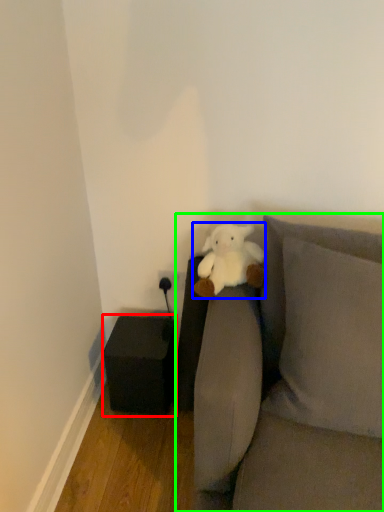
Question: Estimate the real-world distances between objects in this image. Which object is closer to furniture (highlighted by a red box), teddy bear (highlighted by a blue box) or studio couch (highlighted by a green box)?

Choices:
 (A) teddy bear
 (B) studio couch

Answer: (A)